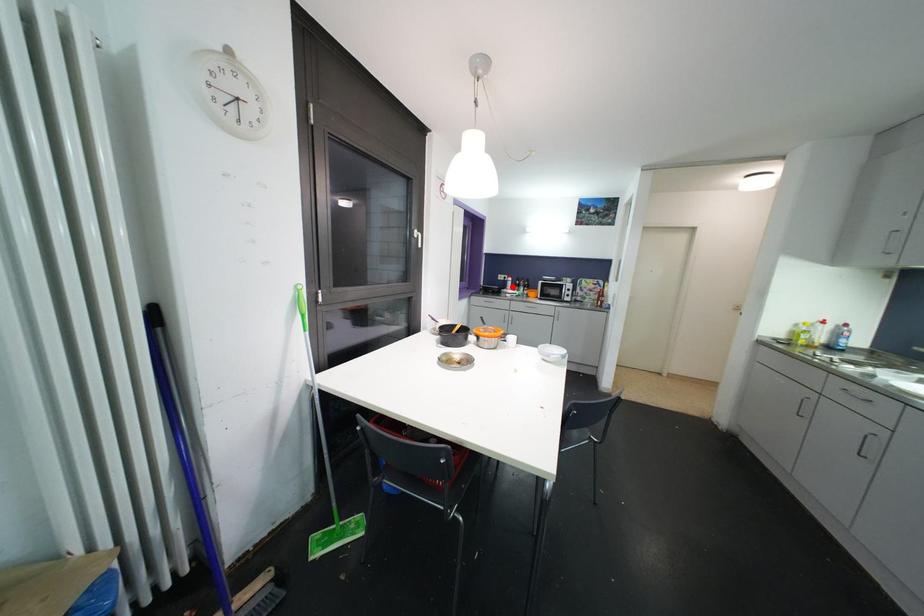
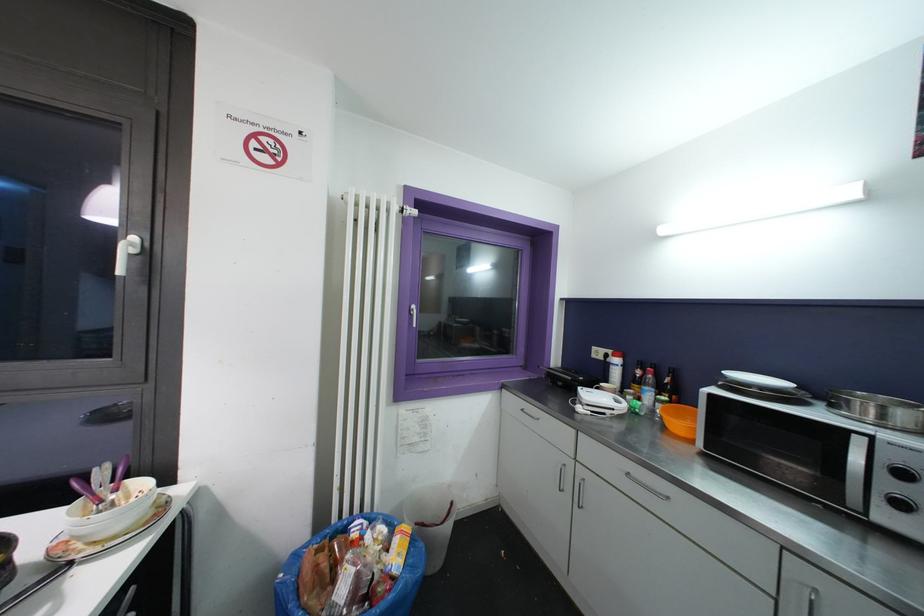
Question: A red point is marked in image1. In image2, is the corresponding 3D point closer to the camera or farther? Reply with the corresponding letter.

Choices:
 (A) The corresponding 3D point is closer.
 (B) The corresponding 3D point is farther.

Answer: (B)